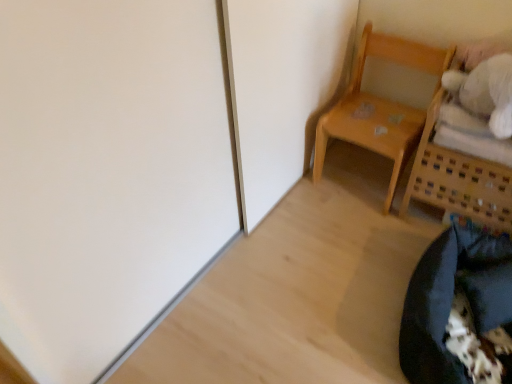
Where is `wooden basket at upper right, which is counted as the 1th furniture, starting from the right`? The height and width of the screenshot is (384, 512). wooden basket at upper right, which is counted as the 1th furniture, starting from the right is located at coordinates (459, 180).

Where is `light wood chair at upper right, which is the second furniture in right-to-left order`? This screenshot has height=384, width=512. light wood chair at upper right, which is the second furniture in right-to-left order is located at coordinates (380, 107).

Is wooden basket at upper right, which is counted as the 1th furniture, starting from the right, positioned far away from light wood chair at upper right, which is the second furniture in right-to-left order?

No.

Does point (411, 172) come farther from viewer compared to point (361, 110)?

No, it is not.

From the image's perspective, is wooden basket at upper right, which is counted as the 1th furniture, starting from the right, below light wood chair at upper right, the first furniture when ordered from left to right?

Yes, from the image's perspective, wooden basket at upper right, which is counted as the 1th furniture, starting from the right, is beneath light wood chair at upper right, the first furniture when ordered from left to right.

Based on the photo, is light wood chair at upper right, which is the second furniture in right-to-left order, located within wooden basket at upper right, the 2th furniture positioned from the left?

Actually, light wood chair at upper right, which is the second furniture in right-to-left order, is outside wooden basket at upper right, the 2th furniture positioned from the left.

Is black fabric bean bag chair at lower right inside the boundaries of light wood chair at upper right, which is the second furniture in right-to-left order, or outside?

black fabric bean bag chair at lower right is located beyond the bounds of light wood chair at upper right, which is the second furniture in right-to-left order.

Which object is more forward, black fabric bean bag chair at lower right or light wood chair at upper right, the first furniture when ordered from left to right?

black fabric bean bag chair at lower right.

Could you tell me if black fabric bean bag chair at lower right is facing light wood chair at upper right, which is the second furniture in right-to-left order?

No.

Is black fabric bean bag chair at lower right taller or shorter than light wood chair at upper right, the first furniture when ordered from left to right?

black fabric bean bag chair at lower right is shorter than light wood chair at upper right, the first furniture when ordered from left to right.

From a real-world perspective, is wooden basket at upper right, the 2th furniture positioned from the left, below black fabric bean bag chair at lower right?

No, from a real-world perspective, wooden basket at upper right, the 2th furniture positioned from the left, is not under black fabric bean bag chair at lower right.

Where is `bean bag chair to the left of wooden basket at upper right, the 2th furniture positioned from the left`? The width and height of the screenshot is (512, 384). bean bag chair to the left of wooden basket at upper right, the 2th furniture positioned from the left is located at coordinates (459, 311).

Looking at their sizes, would you say wooden basket at upper right, which is counted as the 1th furniture, starting from the right, is wider or thinner than black fabric bean bag chair at lower right?

In the image, wooden basket at upper right, which is counted as the 1th furniture, starting from the right, appears to be more narrow than black fabric bean bag chair at lower right.

Is light wood chair at upper right, which is the second furniture in right-to-left order, oriented towards black fabric bean bag chair at lower right?

No.

Choose the correct answer: Is light wood chair at upper right, the first furniture when ordered from left to right, inside black fabric bean bag chair at lower right or outside it?

light wood chair at upper right, the first furniture when ordered from left to right, cannot be found inside black fabric bean bag chair at lower right.

Can you tell me how much light wood chair at upper right, which is the second furniture in right-to-left order, and black fabric bean bag chair at lower right differ in facing direction?

The angular difference between light wood chair at upper right, which is the second furniture in right-to-left order, and black fabric bean bag chair at lower right is 6.72 degrees.

From the picture: From the image's perspective, which is above, light wood chair at upper right, which is the second furniture in right-to-left order, or black fabric bean bag chair at lower right?

light wood chair at upper right, which is the second furniture in right-to-left order, from the image's perspective.

Measure the distance from light wood chair at upper right, the first furniture when ordered from left to right, to wooden basket at upper right, which is counted as the 1th furniture, starting from the right.

light wood chair at upper right, the first furniture when ordered from left to right, is 21.11 centimeters from wooden basket at upper right, which is counted as the 1th furniture, starting from the right.

Is light wood chair at upper right, which is the second furniture in right-to-left order, aimed at wooden basket at upper right, the 2th furniture positioned from the left?

No, light wood chair at upper right, which is the second furniture in right-to-left order, is not facing towards wooden basket at upper right, the 2th furniture positioned from the left.

Which object is further away from the camera, light wood chair at upper right, the first furniture when ordered from left to right, or wooden basket at upper right, which is counted as the 1th furniture, starting from the right?

light wood chair at upper right, the first furniture when ordered from left to right, is more distant.

The image size is (512, 384). I want to click on furniture lying in front of the light wood chair at upper right, which is the second furniture in right-to-left order, so click(x=459, y=180).

Which of these two, black fabric bean bag chair at lower right or wooden basket at upper right, which is counted as the 1th furniture, starting from the right, stands shorter?

black fabric bean bag chair at lower right.

From a real-world perspective, which is physically above, black fabric bean bag chair at lower right or wooden basket at upper right, which is counted as the 1th furniture, starting from the right?

wooden basket at upper right, which is counted as the 1th furniture, starting from the right, from a real-world perspective.

From the image's perspective, starting from the black fabric bean bag chair at lower right, which furniture is the 1st one above? Please provide its 2D coordinates.

[(459, 180)]

Are black fabric bean bag chair at lower right and wooden basket at upper right, which is counted as the 1th furniture, starting from the right, making contact?

black fabric bean bag chair at lower right and wooden basket at upper right, which is counted as the 1th furniture, starting from the right, are not in contact.

The height and width of the screenshot is (384, 512). In order to click on furniture lying above the wooden basket at upper right, the 2th furniture positioned from the left (from the image's perspective) in this screenshot , I will do click(x=380, y=107).

I want to click on bean bag chair in front of the light wood chair at upper right, which is the second furniture in right-to-left order, so click(x=459, y=311).

Based on the photo, considering their positions, is black fabric bean bag chair at lower right positioned closer to light wood chair at upper right, which is the second furniture in right-to-left order, than wooden basket at upper right, which is counted as the 1th furniture, starting from the right?

The object closer to light wood chair at upper right, which is the second furniture in right-to-left order, is wooden basket at upper right, which is counted as the 1th furniture, starting from the right.

Consider the image. Considering their positions, is wooden basket at upper right, the 2th furniture positioned from the left, positioned further to black fabric bean bag chair at lower right than light wood chair at upper right, the first furniture when ordered from left to right?

light wood chair at upper right, the first furniture when ordered from left to right, is positioned further to the anchor black fabric bean bag chair at lower right.

When comparing their distances from black fabric bean bag chair at lower right, does light wood chair at upper right, the first furniture when ordered from left to right, or wooden basket at upper right, the 2th furniture positioned from the left, seem closer?

Among the two, wooden basket at upper right, the 2th furniture positioned from the left, is located nearer to black fabric bean bag chair at lower right.

Based on the photo, looking at the image, which one is located closer to wooden basket at upper right, the 2th furniture positioned from the left, light wood chair at upper right, the first furniture when ordered from left to right, or black fabric bean bag chair at lower right?

The object closer to wooden basket at upper right, the 2th furniture positioned from the left, is light wood chair at upper right, the first furniture when ordered from left to right.

From the image, which object appears to be farther from wooden basket at upper right, which is counted as the 1th furniture, starting from the right, black fabric bean bag chair at lower right or light wood chair at upper right, the first furniture when ordered from left to right?

Based on the image, black fabric bean bag chair at lower right appears to be further to wooden basket at upper right, which is counted as the 1th furniture, starting from the right.

Considering their positions, is wooden basket at upper right, the 2th furniture positioned from the left, positioned further to light wood chair at upper right, the first furniture when ordered from left to right, than black fabric bean bag chair at lower right?

Based on the image, black fabric bean bag chair at lower right appears to be further to light wood chair at upper right, the first furniture when ordered from left to right.

You are a GUI agent. You are given a task and a screenshot of the screen. Output one action in this format:
    pyautogui.click(x=<x>, y=<y>)
    Task: Click on the furniture that lies between light wood chair at upper right, which is the second furniture in right-to-left order, and black fabric bean bag chair at lower right from top to bottom
    The width and height of the screenshot is (512, 384).
    Given the screenshot: What is the action you would take?
    pyautogui.click(x=459, y=180)